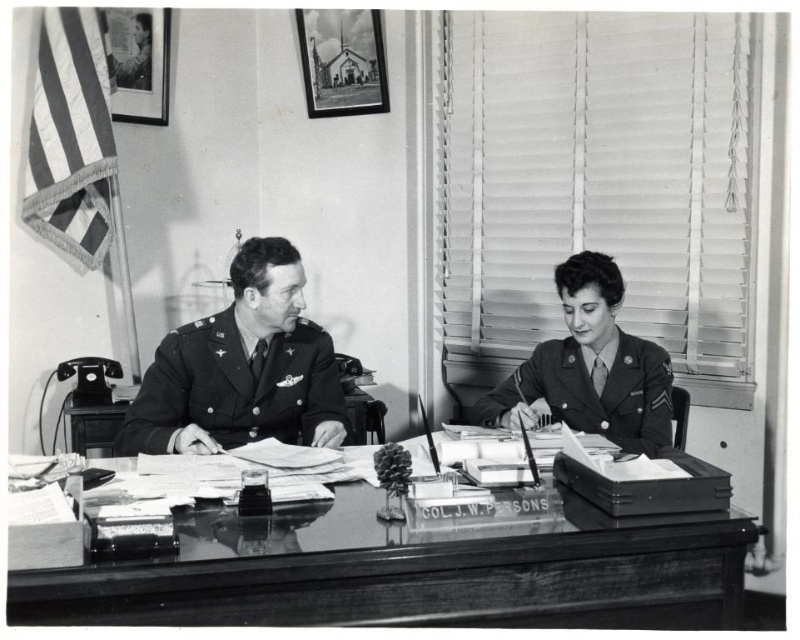
You are a photographer standing in front of the glossy wood table at center. You want to take a photo of the uniformed woman at center without any obstructions. Can you see her clearly from your current position?

The glossy wood table at center is not as tall as the uniformed woman at center, so yes, you can see her clearly without obstruction.

Based on the scene described, where is the glossy wood table at center located in relation to the uniformed woman at center?

The glossy wood table at center is to the left of the uniformed woman at center.

You are a photographer who needs to capture a closeup shot of the uniformed woman at center without including the glossy wood table at center in the frame. Is this possible given their spatial relationship?

The glossy wood table at center might be wider than uniformed woman at center, so it depends on the camera angle and distance. If the table is wider, positioning the camera closer to the woman while framing tightly could exclude the table, but if the table extends beyond her width, it might still appear in the shot.